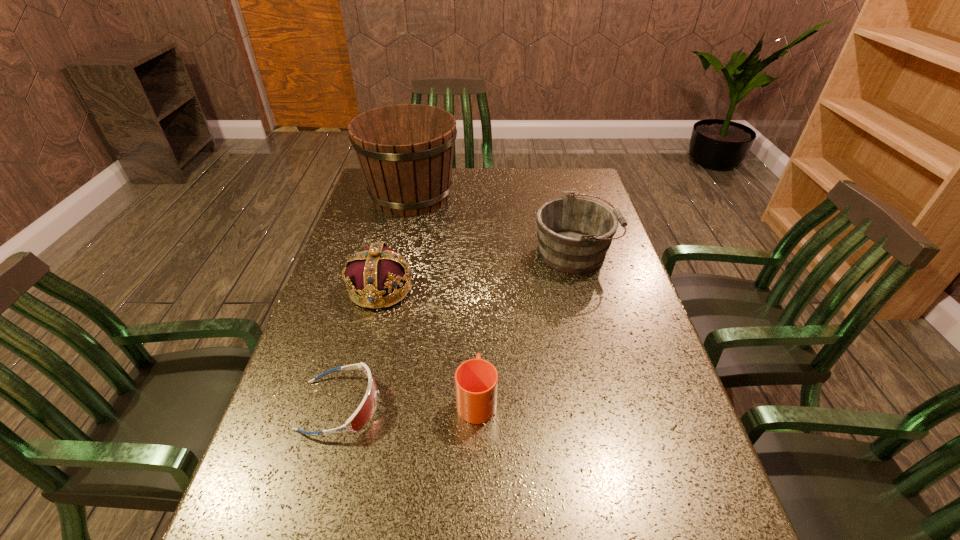
The width and height of the screenshot is (960, 540). Find the location of `object that is at the far left corner`. object that is at the far left corner is located at coordinates click(x=405, y=152).

The image size is (960, 540). I want to click on blank area at the far edge, so click(486, 179).

In the image, there is a desktop. Where is `vacant space at the left edge`? This screenshot has width=960, height=540. vacant space at the left edge is located at coordinates (369, 215).

I want to click on vacant space at the right edge, so click(630, 418).

Locate an element on the screen. free region at the far right corner is located at coordinates (553, 190).

The width and height of the screenshot is (960, 540). Identify the location of empty space that is in between the goggles and the mug. (408, 402).

The height and width of the screenshot is (540, 960). What are the coordinates of `free space between the taller wine bucket and the crown` in the screenshot? It's located at (396, 242).

Where is `vacant space that is in between the goggles and the crown`? This screenshot has width=960, height=540. vacant space that is in between the goggles and the crown is located at coordinates (360, 347).

Where is `vacant area that lies between the left wine bucket and the fourth tallest object`? The image size is (960, 540). vacant area that lies between the left wine bucket and the fourth tallest object is located at coordinates tap(444, 297).

Find the location of a particular element. Image resolution: width=960 pixels, height=540 pixels. free space between the crown and the goggles is located at coordinates (360, 347).